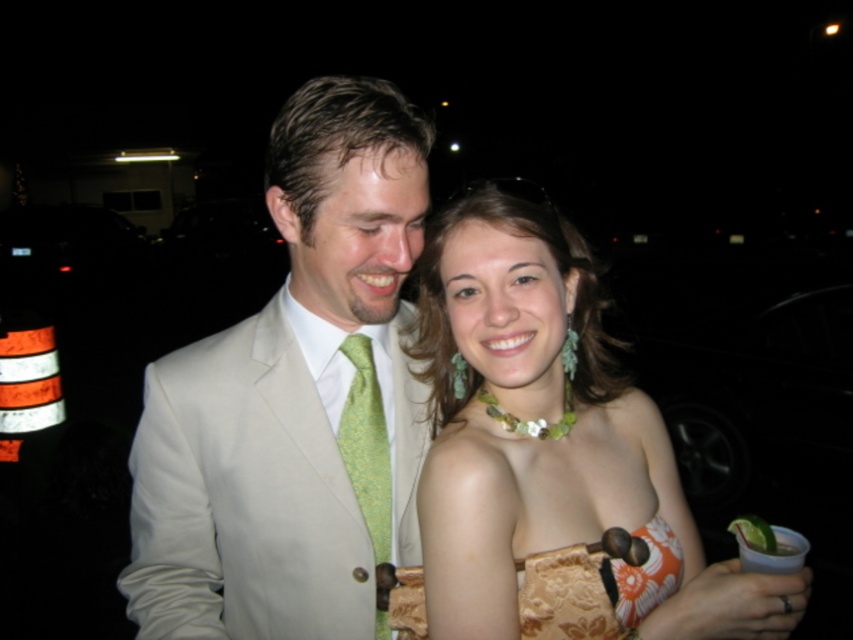
Consider the image. You are a photographer at the event and want to ensure both the matte green necklace at center and the green textured tie at center are clearly visible in the photo. Given their sizes, which one might require more careful framing to avoid being overlooked?

The green textured tie at center is smaller in size compared to the matte green necklace at center, so it might require more careful framing to avoid being overlooked.